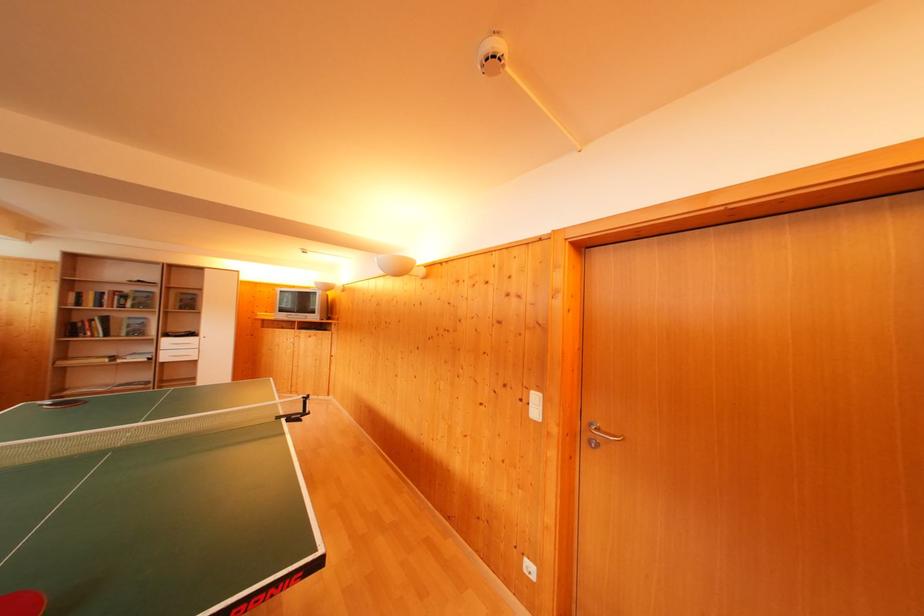
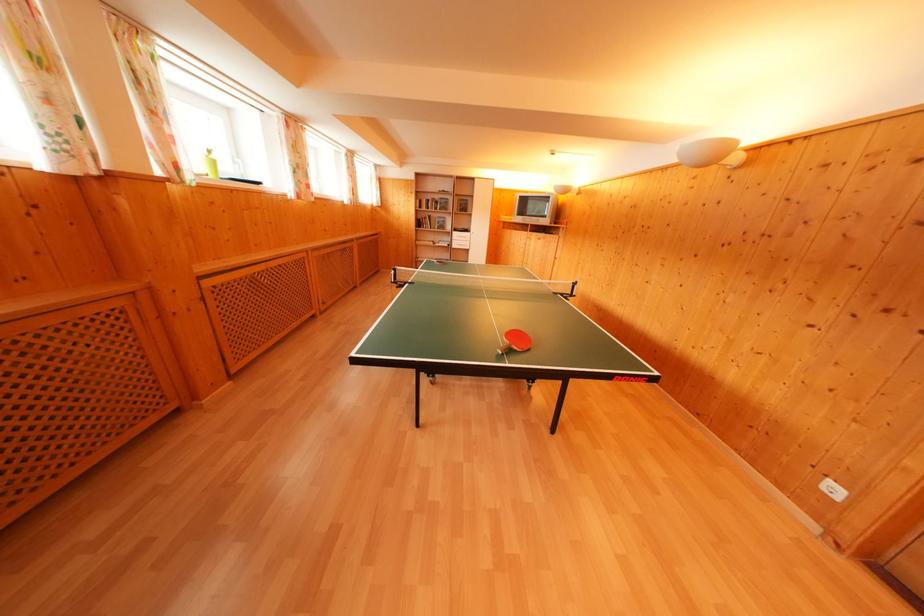
First-person continuous shooting, in which direction is the camera rotating?

The rotation direction of the camera is left-down.